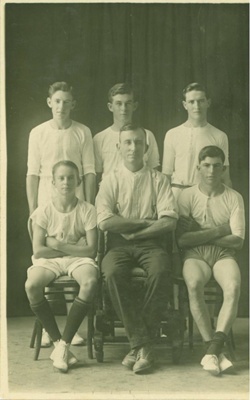
Where is `floor`? The height and width of the screenshot is (400, 250). floor is located at coordinates (91, 392).